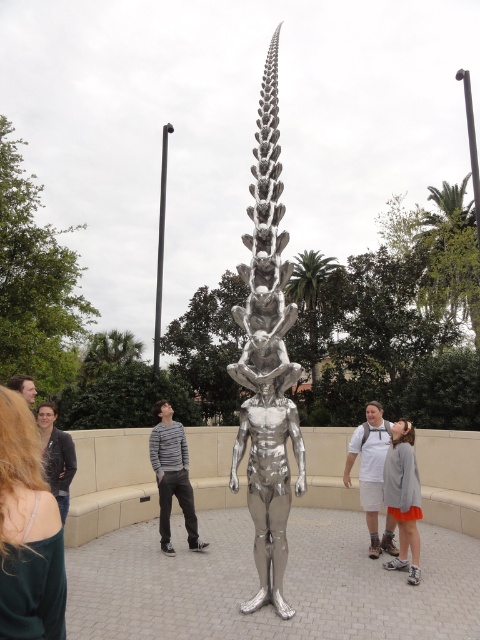
Question: Does silver metallic sculpture at center appear under gray sweater at center?

Choices:
 (A) yes
 (B) no

Answer: (A)

Question: Among these objects, which one is nearest to the camera?

Choices:
 (A) white matte shirt at center
 (B) striped sweater at center
 (C) silver metallic sculpture at center

Answer: (C)

Question: Which of the following is the closest to the observer?

Choices:
 (A) (389, 449)
 (B) (34, 396)

Answer: (B)

Question: Observing the image, what is the correct spatial positioning of gray sweater at center in reference to matte black hair at upper left?

Choices:
 (A) left
 (B) right

Answer: (B)

Question: Can you confirm if green fabric dress at lower left is wider than striped sweater at center?

Choices:
 (A) no
 (B) yes

Answer: (A)

Question: Which of the following is the closest to the observer?

Choices:
 (A) silver metallic sculpture at center
 (B) green fabric dress at lower left

Answer: (B)